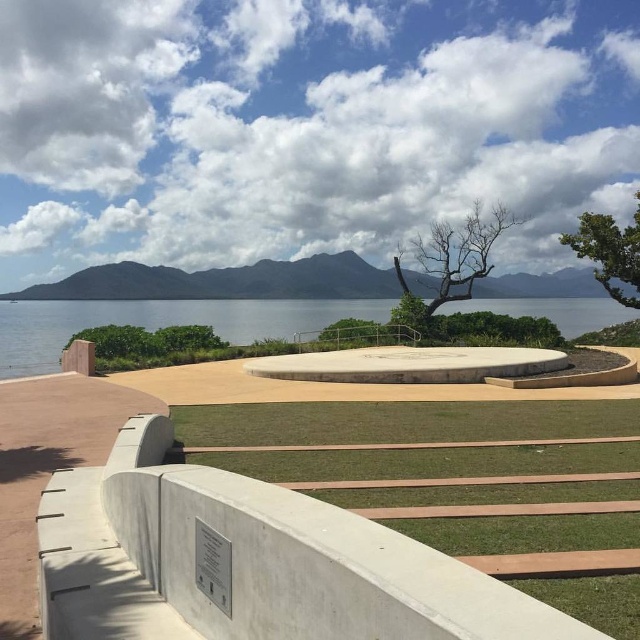
You are planning to place a picnic blanket on the green grass at lower center. Considering the size of the green leafy tree at upper right, will the grass area be large enough to accommodate a standard picnic blanket?

The green grass at lower center might be wider than the green leafy tree at upper right, so the grass area could potentially accommodate a standard picnic blanket, but the exact size isn

From the picture: You are standing at the entrance of the park and see the bare wood tree at center and the green leafy tree at upper right. Which tree would block your view of the distant mountains if you were to stand directly in front of it?

The bare wood tree at center is in front of the green leafy tree at upper right, so standing directly in front of the bare wood tree at center would block your view of the distant mountains more than the green leafy tree at upper right.